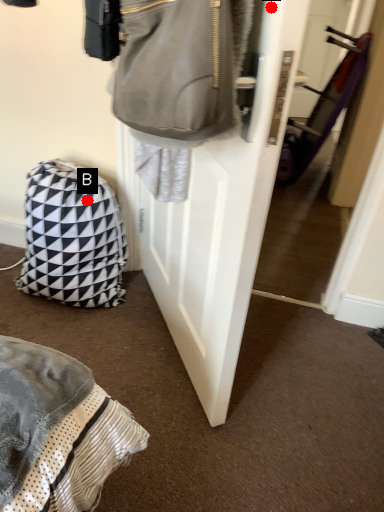
Question: Two points are circled on the image, labeled by A and B beside each circle. Among these points, which one is farthest from the camera?

Choices:
 (A) A is further
 (B) B is further

Answer: (B)